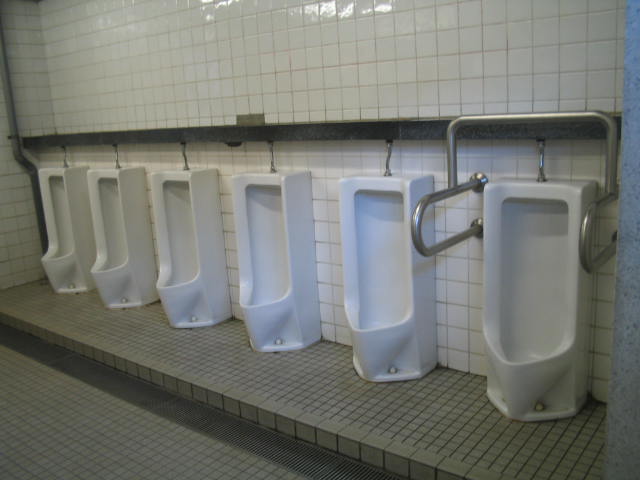
At what (x,y) coordinates should I click in order to perform the action: click on urinals. Please return your answer as a coordinate pair (x, y). This screenshot has width=640, height=480. Looking at the image, I should click on [65, 250], [116, 269], [184, 287], [276, 287], [385, 319], [544, 316].